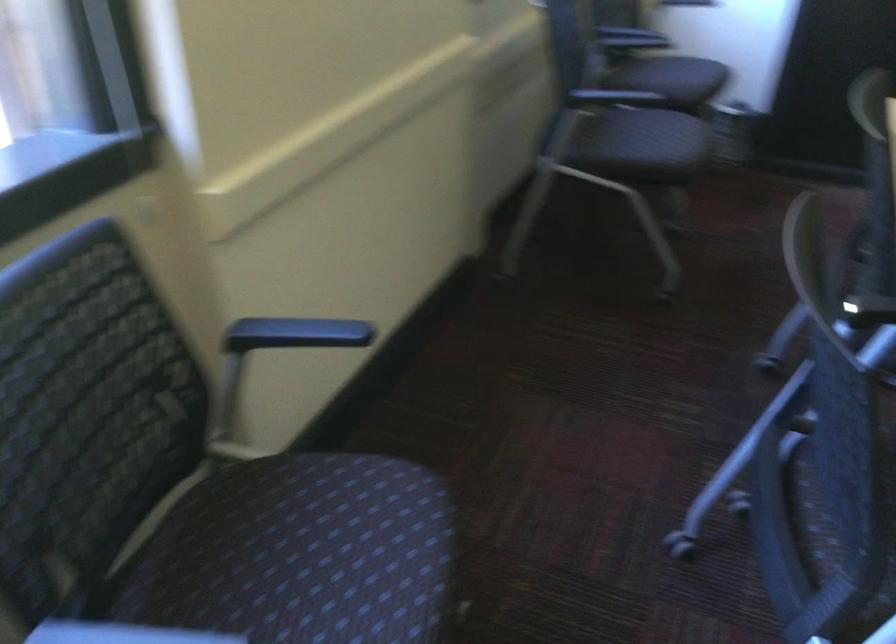
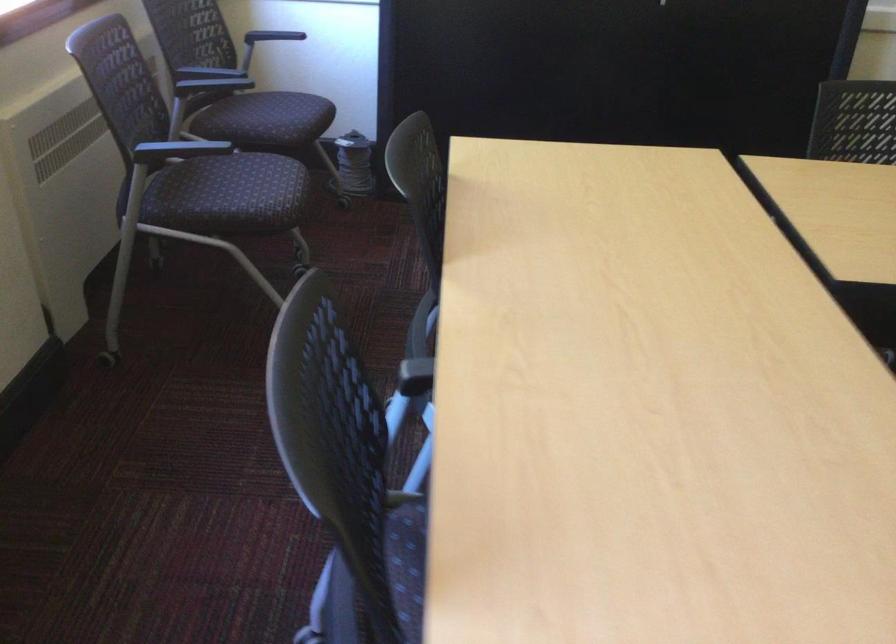
Locate, in the second image, the point that corresponds to (605,98) in the first image.

(176, 149)